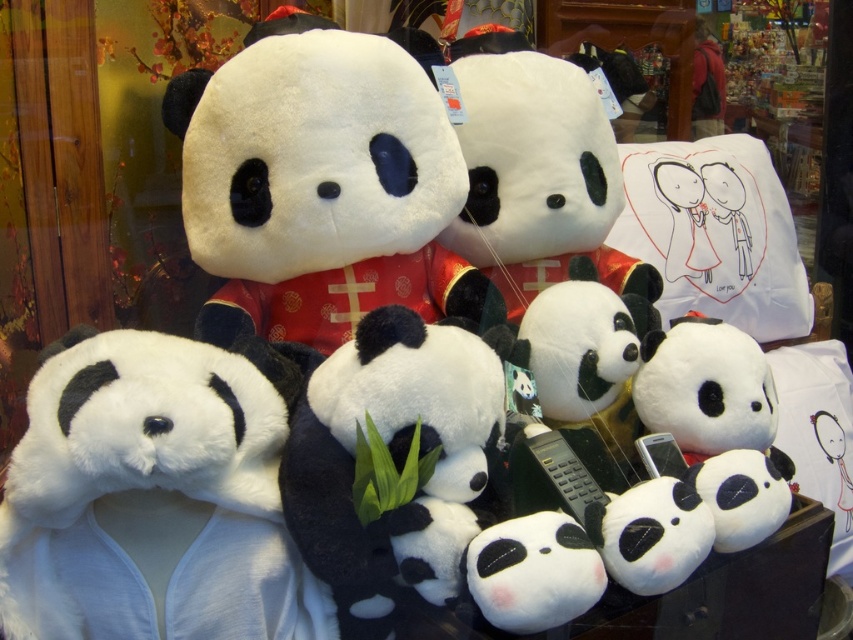
Between fluffy white panda at left and soft plush panda at center, which one is positioned higher?

Positioned higher is soft plush panda at center.

Is fluffy white panda at left taller than soft plush panda at center?

Incorrect, fluffy white panda at left's height is not larger of soft plush panda at center's.

I want to click on fluffy white panda at left, so [x=154, y=496].